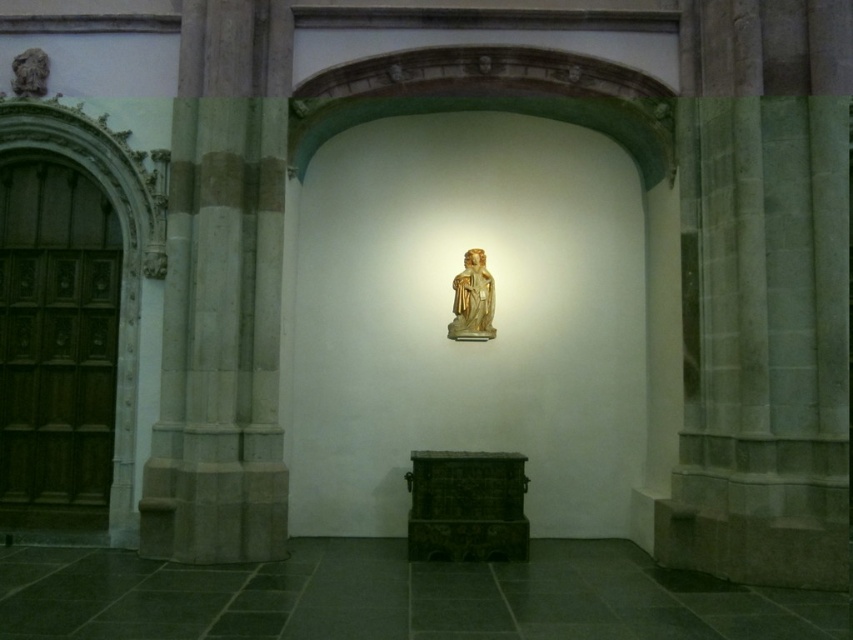
Question: Which point is closer to the camera?

Choices:
 (A) gold polished wood statue at center
 (B) smooth stone pillar at left

Answer: (B)

Question: Can you confirm if smooth stone pillar at left is positioned to the left of gold polished wood statue at center?

Choices:
 (A) no
 (B) yes

Answer: (B)

Question: Is smooth stone pillar at left closer to camera compared to gold polished wood statue at center?

Choices:
 (A) no
 (B) yes

Answer: (B)

Question: Which of the following is the closest to the observer?

Choices:
 (A) gold polished wood statue at center
 (B) smooth stone pillar at left

Answer: (B)

Question: Does smooth stone pillar at left have a smaller size compared to gold polished wood statue at center?

Choices:
 (A) yes
 (B) no

Answer: (B)

Question: Which object appears farthest from the camera in this image?

Choices:
 (A) smooth stone pillar at left
 (B) gold polished wood statue at center

Answer: (B)